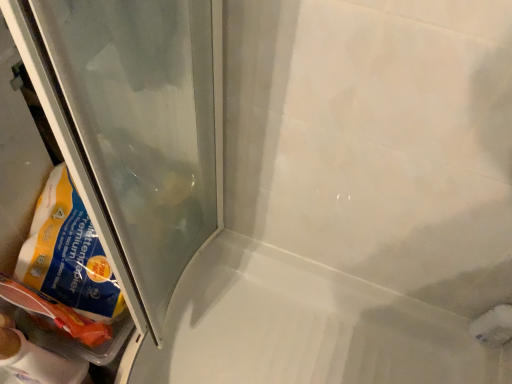
Question: Can you confirm if transparent plastic bag at lower left is smaller than white glossy bath at center?

Choices:
 (A) yes
 (B) no

Answer: (A)

Question: Is transparent plastic bag at lower left positioned beyond the bounds of white glossy bath at center?

Choices:
 (A) yes
 (B) no

Answer: (A)

Question: Could you tell me if transparent plastic bag at lower left is turned towards white glossy bath at center?

Choices:
 (A) no
 (B) yes

Answer: (A)

Question: Can you confirm if transparent plastic bag at lower left is shorter than white glossy bath at center?

Choices:
 (A) no
 (B) yes

Answer: (A)

Question: Is transparent plastic bag at lower left bigger than white glossy bath at center?

Choices:
 (A) yes
 (B) no

Answer: (B)

Question: Is white glossy bath at center surrounded by transparent plastic bag at lower left?

Choices:
 (A) yes
 (B) no

Answer: (B)

Question: Can transparent plastic bag at lower left be found inside white glossy bath at center?

Choices:
 (A) yes
 (B) no

Answer: (B)

Question: Is white glossy bath at center smaller than transparent plastic bag at lower left?

Choices:
 (A) no
 (B) yes

Answer: (A)

Question: Considering the relative positions of white glossy bath at center and transparent plastic bag at lower left in the image provided, is white glossy bath at center behind transparent plastic bag at lower left?

Choices:
 (A) no
 (B) yes

Answer: (B)

Question: Can you confirm if white glossy bath at center is wider than transparent plastic bag at lower left?

Choices:
 (A) yes
 (B) no

Answer: (A)

Question: Does white glossy bath at center have a greater height compared to transparent plastic bag at lower left?

Choices:
 (A) no
 (B) yes

Answer: (A)

Question: Is white glossy bath at center directly adjacent to transparent plastic bag at lower left?

Choices:
 (A) no
 (B) yes

Answer: (A)

Question: Visually, is white glossy bath at center positioned to the left or to the right of transparent plastic bag at lower left?

Choices:
 (A) right
 (B) left

Answer: (A)